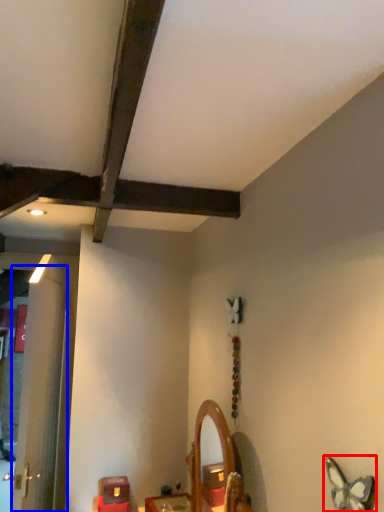
Question: Which of the following is the farthest to the observer, butterfly (highlighted by a red box) or door (highlighted by a blue box)?

Choices:
 (A) butterfly
 (B) door

Answer: (B)